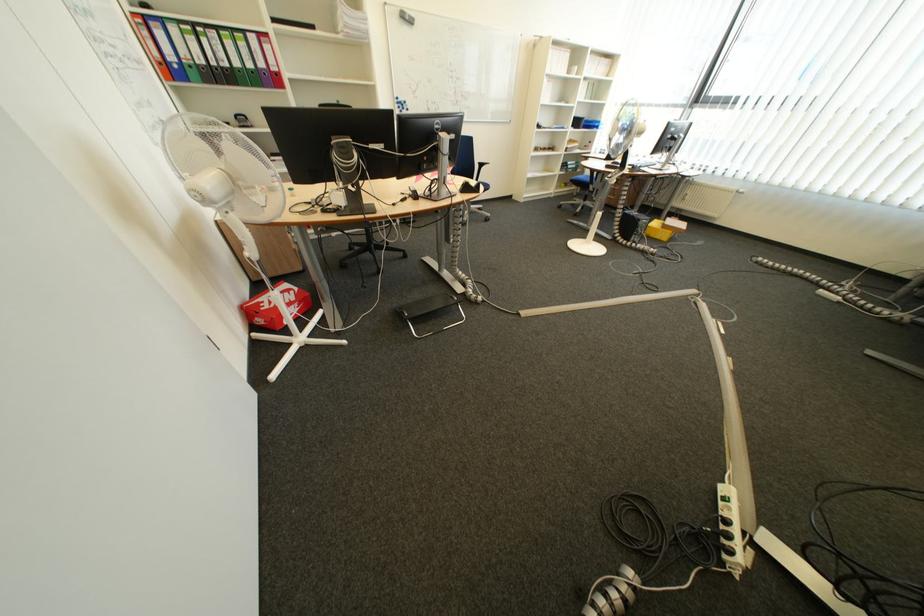
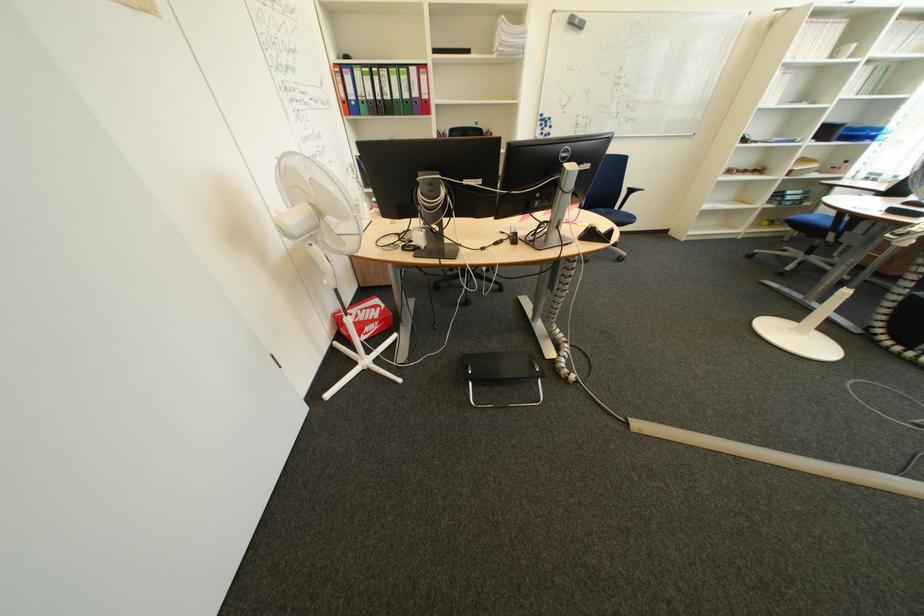
The point at (466, 138) is marked in the first image. Where is the corresponding point in the second image?

(601, 168)